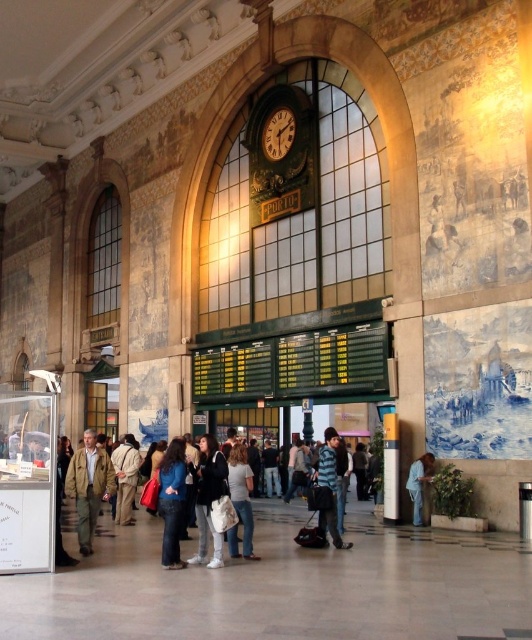
Is denim jacket at center taller than blue fabric shirt at lower right?

Yes.

Can you confirm if denim jacket at center is thinner than blue fabric shirt at lower right?

No.

Is point (331, 449) positioned behind point (433, 464)?

No, (331, 449) is in front of (433, 464).

At what (x,y) coordinates should I click in order to perform the action: click on denim jacket at center. Please return your answer as a coordinate pair (x, y). Looking at the image, I should click on (202, 499).

Can you confirm if black leather jacket at center is positioned below blue fabric shirt at lower right?

No.

Which is above, black leather jacket at center or blue fabric shirt at lower right?

black leather jacket at center

You are a GUI agent. You are given a task and a screenshot of the screen. Output one action in this format:
    pyautogui.click(x=<x>, y=<y>)
    Task: Click on the black leather jacket at center
    The height and width of the screenshot is (640, 532).
    Given the screenshot: What is the action you would take?
    pyautogui.click(x=209, y=499)

Measure the distance from denim jacket at center to light brown leather jacket at center.

denim jacket at center is 7.10 meters from light brown leather jacket at center.

Between point (160, 474) and point (122, 449), which one is positioned behind?

Point (122, 449)

The image size is (532, 640). Find the location of `denim jacket at center`. denim jacket at center is located at coordinates (202, 499).

Locate an element on the screen. The width and height of the screenshot is (532, 640). denim jacket at center is located at coordinates (202, 499).